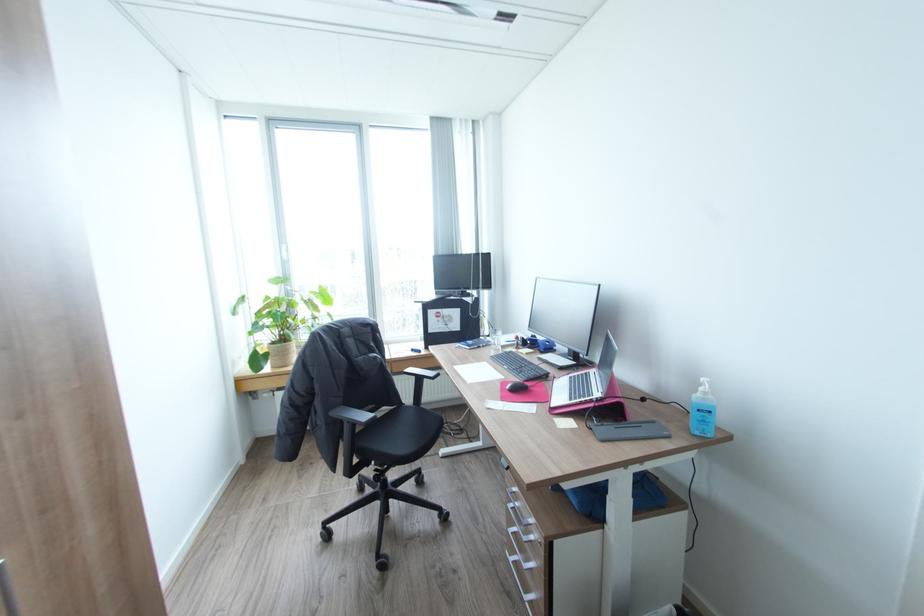
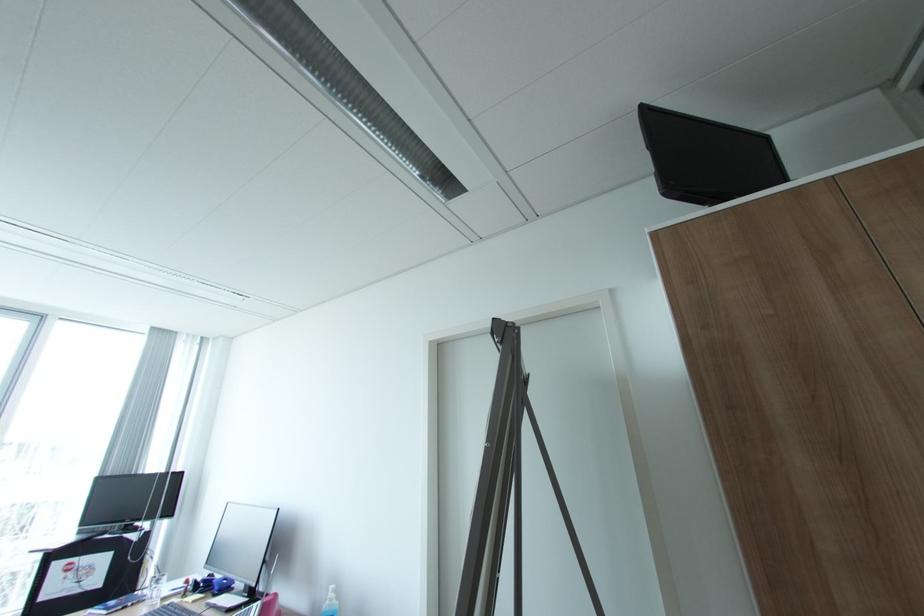
Locate, in the second image, the point that corresponds to [502,344] in the first image.

(160, 596)